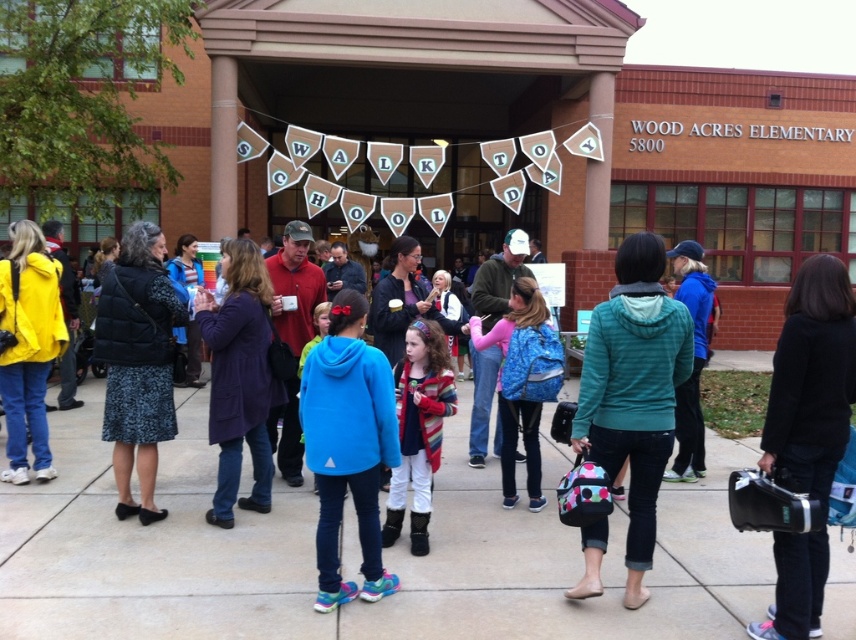
Where is the blue fleece jacket at center located in the image?

The blue fleece jacket at center is located at point (x=382, y=554) in the image.

You are a photographer trying to capture a photo of the group at Wood Acres Elementary School. You want to ensure both the blue fleece jacket at center and the striped sweater at center are in the frame. Which object should you position closer to the left side of the camera viewfinder to include both?

To include both the blue fleece jacket at center and the striped sweater at center in the frame, position the striped sweater at center closer to the left side of the camera viewfinder since the blue fleece jacket at center is to the right of it.